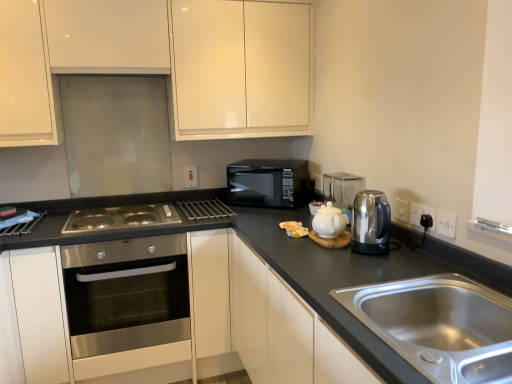
Question: From the image's perspective, is white plastic electric outlet at upper center, which appears as the 3th electric outlet when viewed from the right, located above or below metallic silver rack at center, which is the 3th appliance from right to left?

Choices:
 (A) above
 (B) below

Answer: (A)

Question: Relative to metallic silver rack at center, placed as the first appliance when sorted from left to right, is white plastic electric outlet at upper center, which appears as the 3th electric outlet when viewed from the right, in front or behind?

Choices:
 (A) front
 (B) behind

Answer: (B)

Question: Which is nearer to the stainless steel sink at lower right?

Choices:
 (A) black plastic socket at right, arranged as the second electric outlet when viewed from the front
 (B) black matte microwave at center
 (C) white plastic electric outlet at center, arranged as the 1th electric outlet when viewed from the back
 (D) white plastic electric outlet at upper center, which ranks as the third electric outlet in front-to-back order
 (E) metallic silver rack at center, which is the 3th appliance from right to left

Answer: (A)

Question: Which object is positioned closest to the satin metallic kettle at right, the 3th appliance when ordered from back to front?

Choices:
 (A) stainless steel oven at lower left, arranged as the 1th cabinetry when ordered from the bottom
 (B) white plastic electric outlet at right, marked as the 4th electric outlet in a back-to-front arrangement
 (C) stainless steel oven at center-left
 (D) black plastic socket at right, positioned as the second electric outlet in right-to-left order
 (E) metallic silver rack at center, placed as the first appliance when sorted from left to right

Answer: (D)